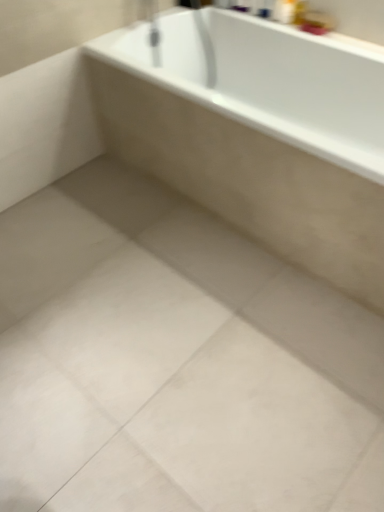
Locate an element on the screen. This screenshot has height=512, width=384. white glossy bathtub at upper center is located at coordinates (268, 80).

What do you see at coordinates (268, 80) in the screenshot? I see `white glossy bathtub at upper center` at bounding box center [268, 80].

Measure the distance between point (x=231, y=97) and camera.

They are 2.29 meters apart.

At what (x,y) coordinates should I click in order to perform the action: click on white glossy bathtub at upper center. Please return your answer as a coordinate pair (x, y). This screenshot has width=384, height=512. Looking at the image, I should click on (268, 80).